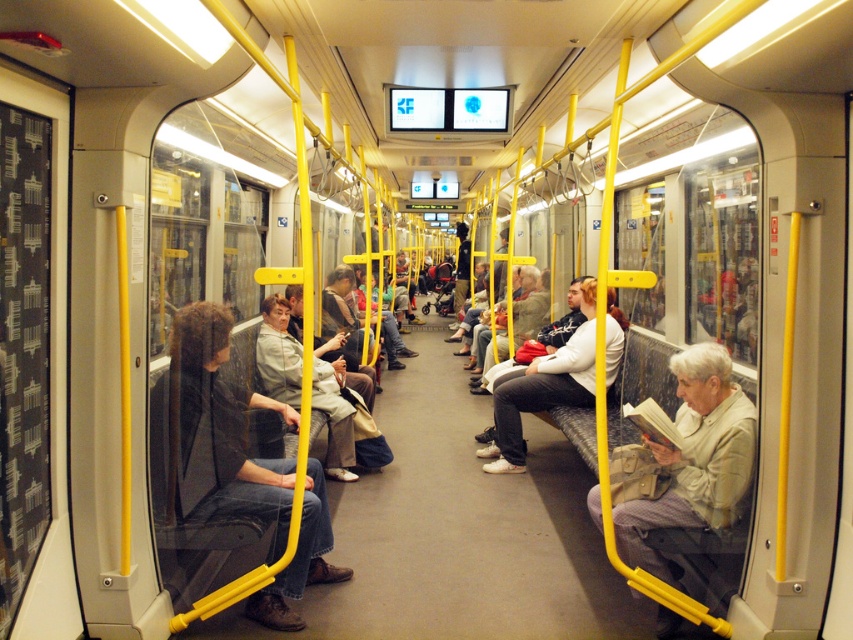
Question: Which object is closer to the camera taking this photo?

Choices:
 (A) dark gray jeans at center
 (B) light beige jacket at center
 (C) white matte jacket at center

Answer: (B)

Question: Which of the following is the closest to the observer?

Choices:
 (A) dark gray jeans at center
 (B) white matte jacket at center
 (C) light beige jacket at center

Answer: (C)

Question: Among these points, which one is nearest to the camera?

Choices:
 (A) (310, 502)
 (B) (618, 355)

Answer: (A)

Question: Is light beige jacket at center further to the viewer compared to white matte jacket at center?

Choices:
 (A) yes
 (B) no

Answer: (B)

Question: Is light beige jacket at center wider than white matte jacket at center?

Choices:
 (A) no
 (B) yes

Answer: (A)

Question: Observing the image, what is the correct spatial positioning of light beige jacket at center in reference to white matte jacket at center?

Choices:
 (A) left
 (B) right

Answer: (B)